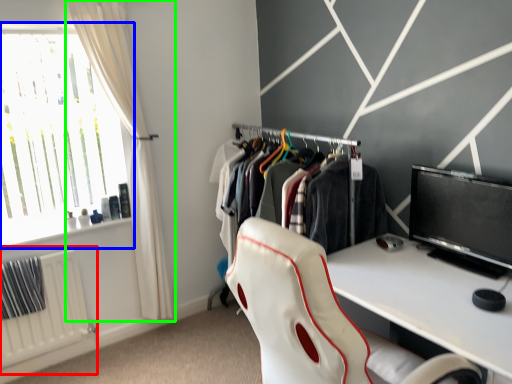
Question: Considering the real-world distances, which object is farthest from radiator (highlighted by a red box)? window (highlighted by a blue box) or curtain (highlighted by a green box)?

Choices:
 (A) window
 (B) curtain

Answer: (B)